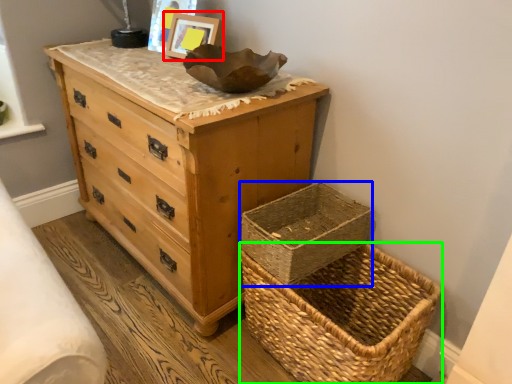
Question: Considering the real-world distances, which object is farthest from picture frame (highlighted by a red box)? basket container (highlighted by a blue box) or picnic basket (highlighted by a green box)?

Choices:
 (A) basket container
 (B) picnic basket

Answer: (B)